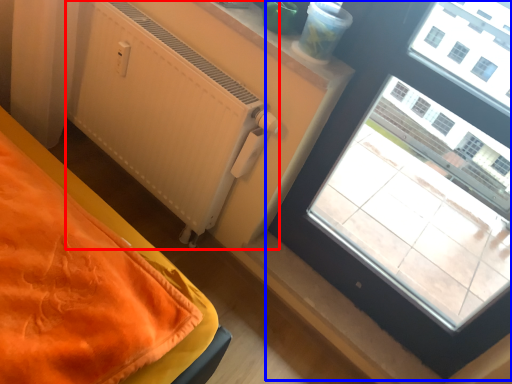
Question: Which point is closer to the camera, radiator (highlighted by a red box) or window (highlighted by a blue box)?

Choices:
 (A) radiator
 (B) window

Answer: (B)